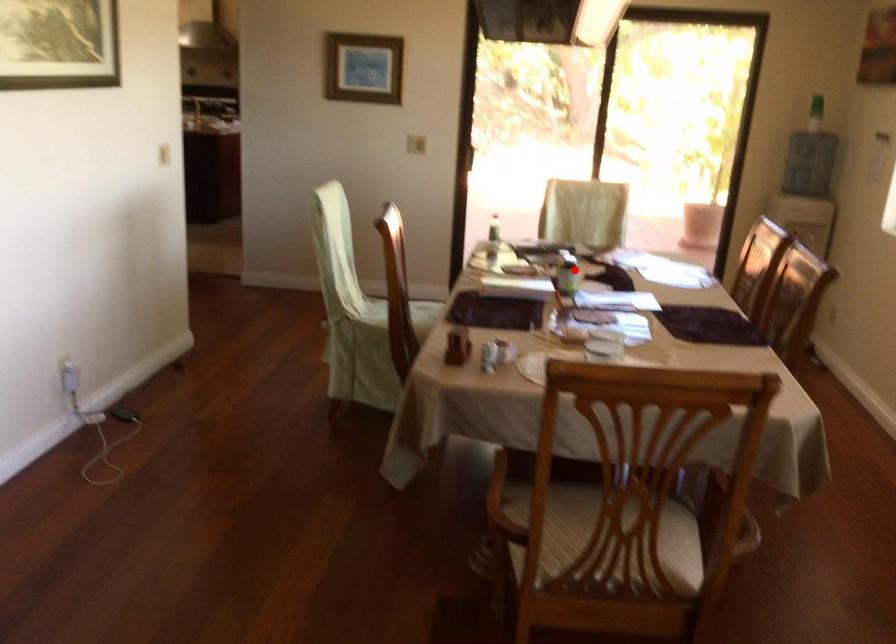
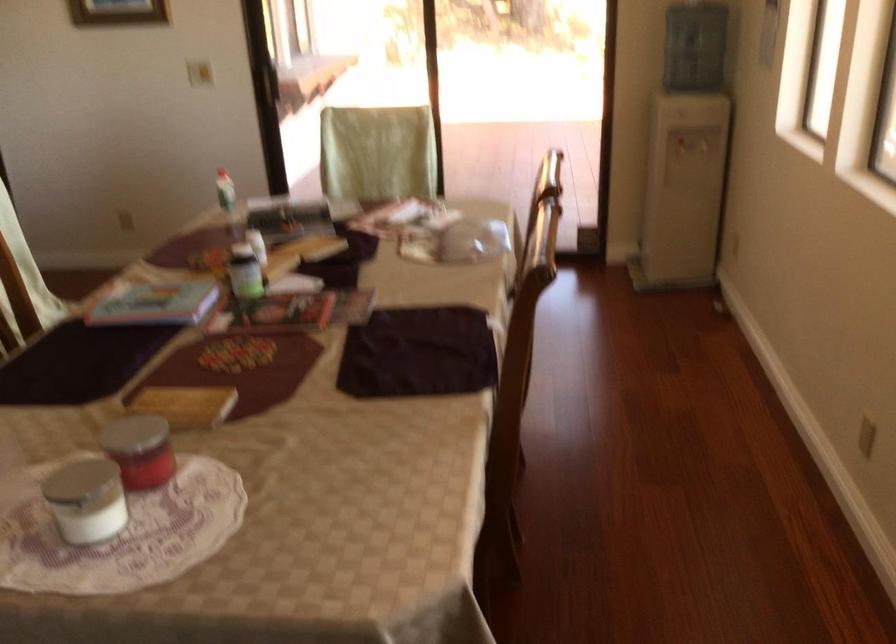
Question: I am providing you with two images of the same scene from different viewpoints. Image1 has a red point marked. In image2, the corresponding 3D location appears at what relative position? Reply with the corresponding letter.

Choices:
 (A) Closer
 (B) Farther

Answer: (A)